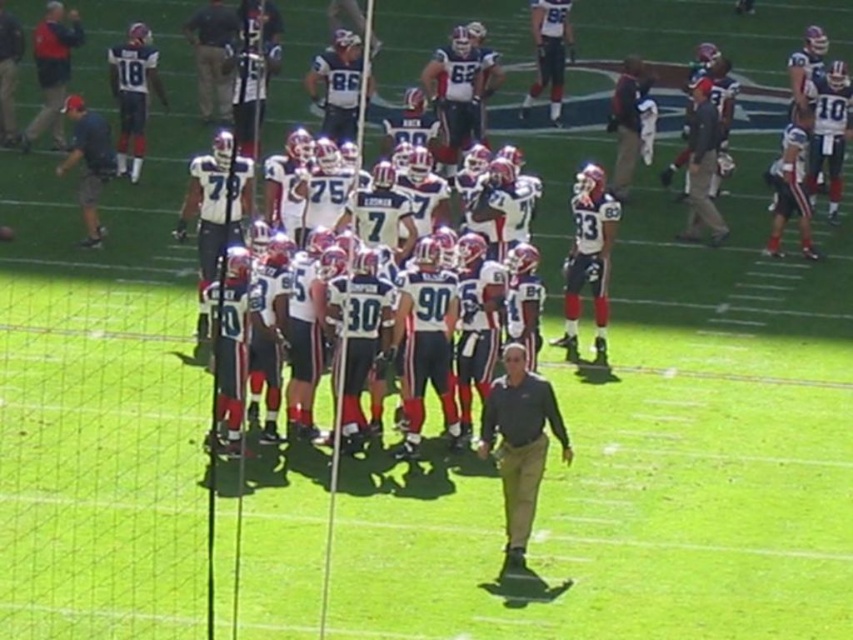
In the scene shown: What is the exact location of the dark green shirt at center in the image?

The dark green shirt at center is located at point coordinates of (x=519, y=444).

You are a photographer positioned at the origin point of the image coordinate system. You want to take a photo of the white matte uniform at center. What are the coordinates where you should aim your camera to capture the uniform?

The coordinates to aim the camera are at point (x=264, y=316) to capture the white matte uniform at center.

Based on the scene, which object is wider, the white matte uniform at center or the matte black jacket at upper left?

The white matte uniform at center is wider than the matte black jacket at upper left according to the description.